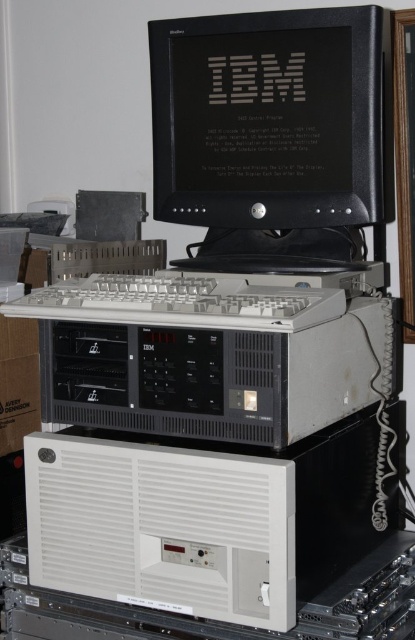
Question: Does gray matte keyboard at center lie behind white plastic keyboard at center?

Choices:
 (A) yes
 (B) no

Answer: (A)

Question: Does gray matte keyboard at center have a smaller size compared to white plastic keyboard at center?

Choices:
 (A) yes
 (B) no

Answer: (B)

Question: Is white plastic keyboard at center to the right of white cardboard box at lower left from the viewer's perspective?

Choices:
 (A) yes
 (B) no

Answer: (A)

Question: Which point appears closest to the camera in this image?

Choices:
 (A) (305, 346)
 (B) (126, 292)

Answer: (A)

Question: Which point is closer to the camera?

Choices:
 (A) (270, 317)
 (B) (21, 321)
 (C) (292, 291)
 (D) (187, 26)

Answer: (A)

Question: Which of these objects is positioned farthest from the white plastic keyboard at center?

Choices:
 (A) black glossy monitor at center
 (B) white cardboard box at lower left

Answer: (B)